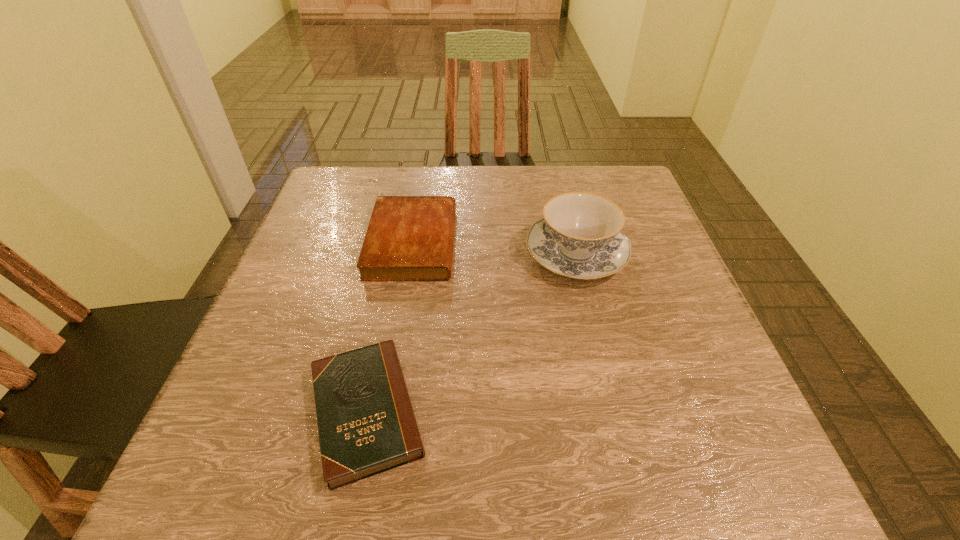
Locate an element on the screen. Image resolution: width=960 pixels, height=540 pixels. free spot located on the right of the nearest object is located at coordinates (462, 411).

This screenshot has width=960, height=540. I want to click on object that is positioned at the far edge, so click(x=409, y=238).

Find the location of a particular element. This screenshot has height=540, width=960. object situated at the near edge is located at coordinates (366, 424).

Locate an element on the screen. The height and width of the screenshot is (540, 960). object that is at the left edge is located at coordinates (366, 424).

This screenshot has width=960, height=540. Identify the location of object positioned at the right edge. (580, 236).

I want to click on object positioned at the near left corner, so click(366, 424).

Locate an element on the screen. This screenshot has width=960, height=540. free region at the far edge of the desktop is located at coordinates (493, 208).

The height and width of the screenshot is (540, 960). I want to click on vacant space at the near edge, so click(x=311, y=458).

The width and height of the screenshot is (960, 540). What are the coordinates of `free point at the left edge` in the screenshot? It's located at (249, 345).

I want to click on blank space at the right edge of the desktop, so click(690, 356).